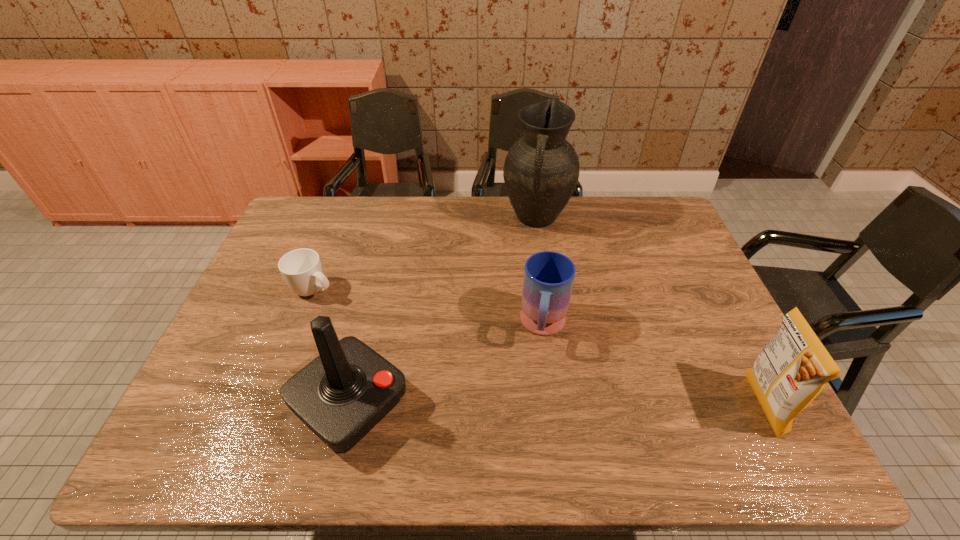
Find the location of a particular element. vacant point located between the third shortest object and the second shortest object is located at coordinates [653, 366].

Find the location of `vacant space that is in between the cup and the fourth tallest object`. vacant space that is in between the cup and the fourth tallest object is located at coordinates (429, 308).

Locate an element on the screen. vacant space that's between the cup and the rightmost object is located at coordinates (538, 348).

Find the location of a particular element. The height and width of the screenshot is (540, 960). the closest object to the rightmost object is located at coordinates (549, 276).

Select which object appears as the second closest to the crisp (potato chip). Please provide its 2D coordinates. Your answer should be formatted as a tuple, i.e. [(x, y)], where the tuple contains the x and y coordinates of a point satisfying the conditions above.

[(541, 170)]

What are the coordinates of `free location that satisfies the following two spatial constraints: 1. on the front side of the rightmost object; 2. on the front of the fourth tallest object with the logo` in the screenshot? It's located at (555, 406).

I want to click on free space in the image that satisfies the following two spatial constraints: 1. on the front side of the second shortest object; 2. on the front of the third shortest object with the logo, so click(555, 406).

Where is `vacant region that satisfies the following two spatial constraints: 1. on the back side of the shortest object; 2. on the right side of the pitcher`? The width and height of the screenshot is (960, 540). vacant region that satisfies the following two spatial constraints: 1. on the back side of the shortest object; 2. on the right side of the pitcher is located at coordinates (341, 218).